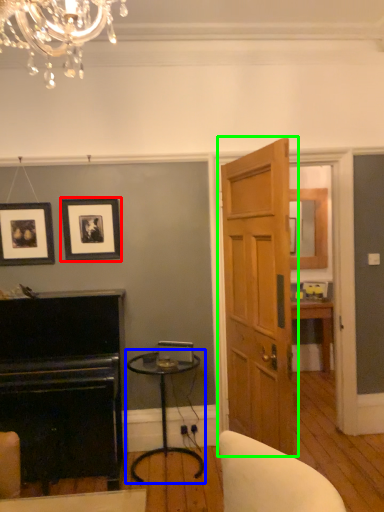
Question: Estimate the real-world distances between objects in this image. Which object is closer to picture frame (highlighted by a red box), table (highlighted by a blue box) or door (highlighted by a green box)?

Choices:
 (A) table
 (B) door

Answer: (A)